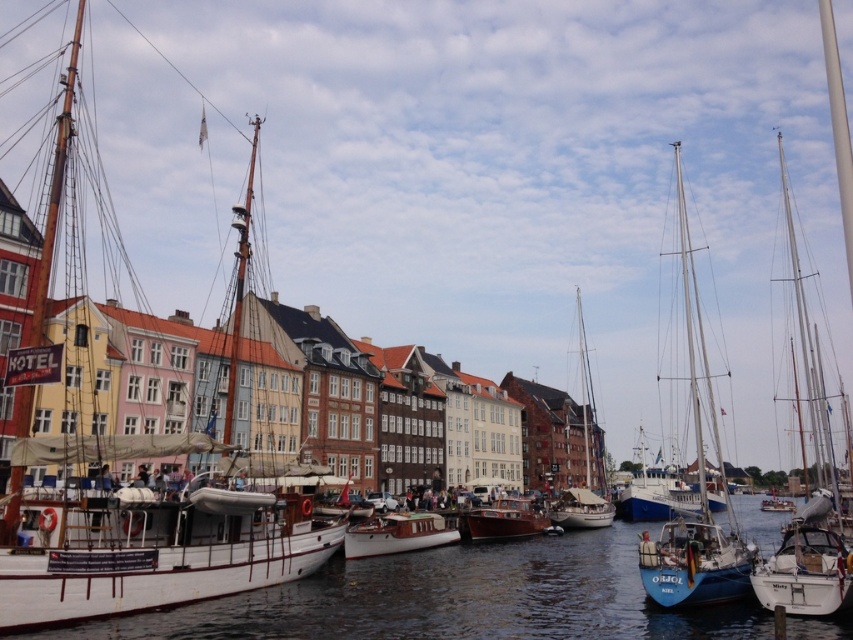
You are a tourist standing at the point labeled as point (579, 509) in the harbor scene. Which object are you currently standing on?

You are standing on the white matte boat at center, as the point (579, 509) is located on that object.

You are a tour guide leading a group of visitors on a walking tour of the harbor. You want to point out both the wooden polished boat at center and the wooden sailboat at center. Since you can only point in one direction, which boat will you point to first based on their positions relative to each other?

You should point to the wooden sailboat at center first because the wooden polished boat at center is 107.78 meters away from it, indicating they are positioned in opposite directions from your current location.

From the picture: You are a tourist standing on the dock and see both the wooden polished boat at center and the wooden sailboat at center. Which boat is positioned higher relative to the other?

The wooden polished boat at center is positioned higher than the wooden sailboat at center because it is above it.